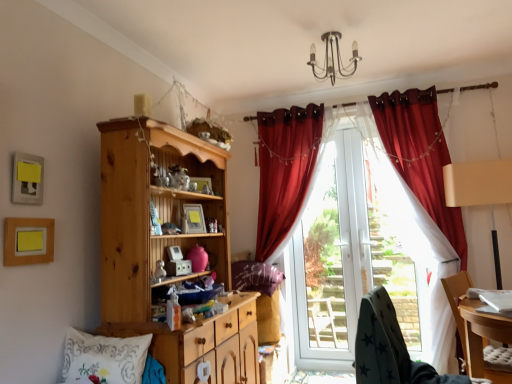
Question: In the image, is white embroidered pillow at lower left, the second pillow positioned from the right, on the left side or the right side of purple fabric pillow at center, which is counted as the first pillow, starting from the right?

Choices:
 (A) right
 (B) left

Answer: (B)

Question: From the image's perspective, is white embroidered pillow at lower left, the 2th pillow viewed from the back, located above or below purple fabric pillow at center, the 2th pillow from the left?

Choices:
 (A) below
 (B) above

Answer: (A)

Question: Which of these objects is positioned closest to the matte yellow picture frame at upper left, acting as the 1th picture frame starting from the left?

Choices:
 (A) wooden chair at lower right, which appears as the second chair when viewed from the left
 (B) natural wood cabinet at left
 (C) transparent glass door at center
 (D) white glossy screen door at center
 (E) metallic chandelier at upper center

Answer: (B)

Question: Which object is positioned farthest from the matte yellow picture frame at upper left, arranged as the 3th picture frame when viewed from the back?

Choices:
 (A) dark grey fabric chair at lower right, positioned as the second chair in right-to-left order
 (B) transparent glass door at center
 (C) white embroidered pillow at lower left, the 2th pillow viewed from the back
 (D) wooden picture frame at lower left, positioned as the second picture frame in left-to-right order
 (E) white glossy screen door at center

Answer: (E)